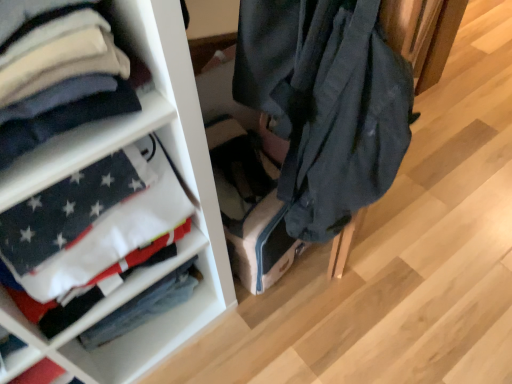
Image resolution: width=512 pixels, height=384 pixels. I want to click on unoccupied area in front of white cotton flag at left, so click(x=146, y=352).